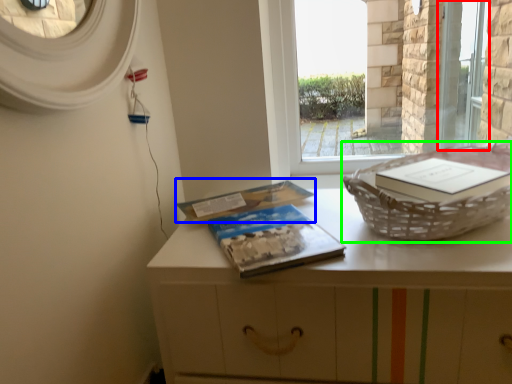
Question: Based on their relative distances, which object is nearer to screen door (highlighted by a red box)? Choose from paperback book (highlighted by a blue box) and basket container (highlighted by a green box).

Choices:
 (A) paperback book
 (B) basket container

Answer: (B)